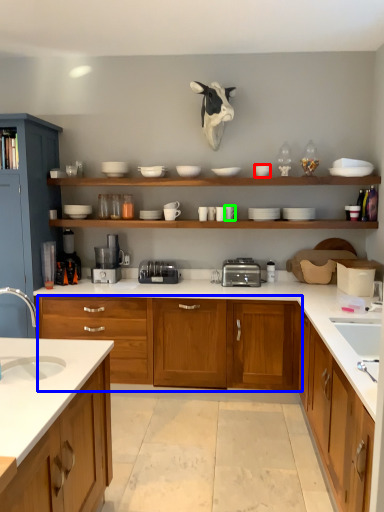
Question: Which object is the closest to the tableware (highlighted by a red box)? Choose among these: cabinetry (highlighted by a blue box) or tableware (highlighted by a green box).

Choices:
 (A) cabinetry
 (B) tableware

Answer: (B)